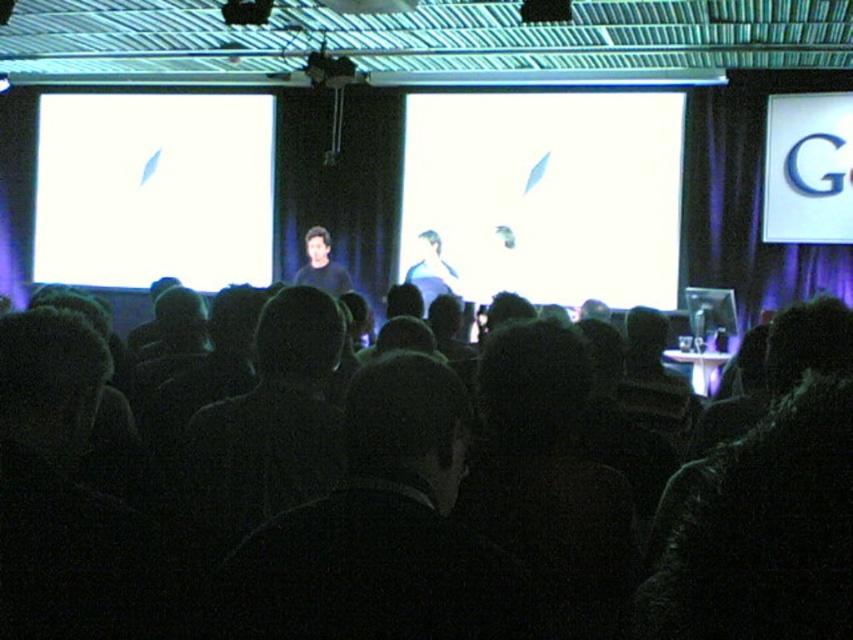
You are an attendee in the conference room and want to take a photo of the presentation. Since the white matte projection screen at center and the black matte speaker at center are both in your camera frame, which one should you focus on to capture the content displayed on the screen clearly?

The white matte projection screen at center has a greater width than the black matte speaker at center, so focusing on the white matte projection screen at center will ensure the content displayed is captured clearly as it occupies more space in the frame.

You are an attendee sitting in the front row of the conference room. You want to take a photo of the presentation displayed on the white matte projection screen at center. However, your phone camera has a limited field of view. Based on the coordinates given, can you estimate whether the white matte projection screen at center is fully visible in your photo if you aim your camera directly at the point represented by point [547,193]?

The white matte projection screen at center is represented by point [547,193], so aiming the camera directly at that point would center the screen in the photo. Since the point is the screen itself, it should be fully visible in the photo.

You are a stagehand carrying a 7.5 feet long ladder that needs to be placed between the white matte projection screen at center and the black matte speaker at center. Is there enough space to place the ladder horizontally between them without it overlapping either object?

The distance between the white matte projection screen at center and the black matte speaker at center is 8.05 feet. Since the ladder is 7.5 feet long, there is sufficient space to place it horizontally between them without overlapping either object.